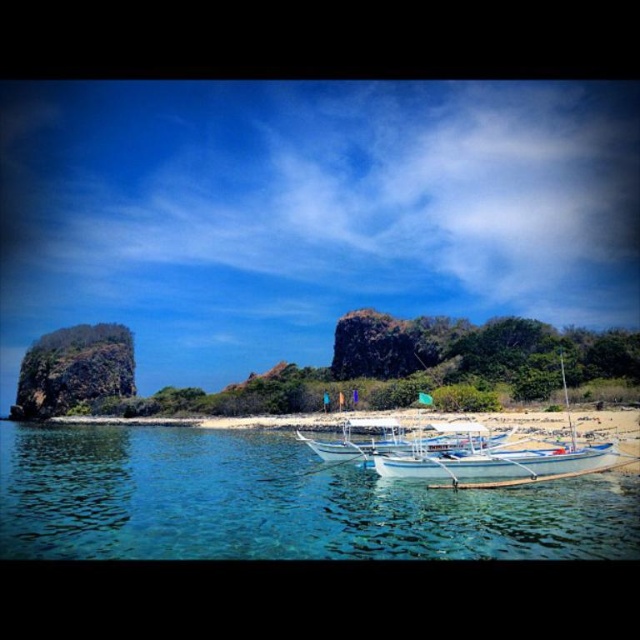
Who is lower down, clear blue water at lower center or white wooden boat at center?

clear blue water at lower center

Can you confirm if clear blue water at lower center is positioned above white wooden boat at center?

No, clear blue water at lower center is not above white wooden boat at center.

Who is more distant from viewer, [275,444] or [588,465]?

The point [275,444] is behind.

Identify the location of clear blue water at lower center. (275, 502).